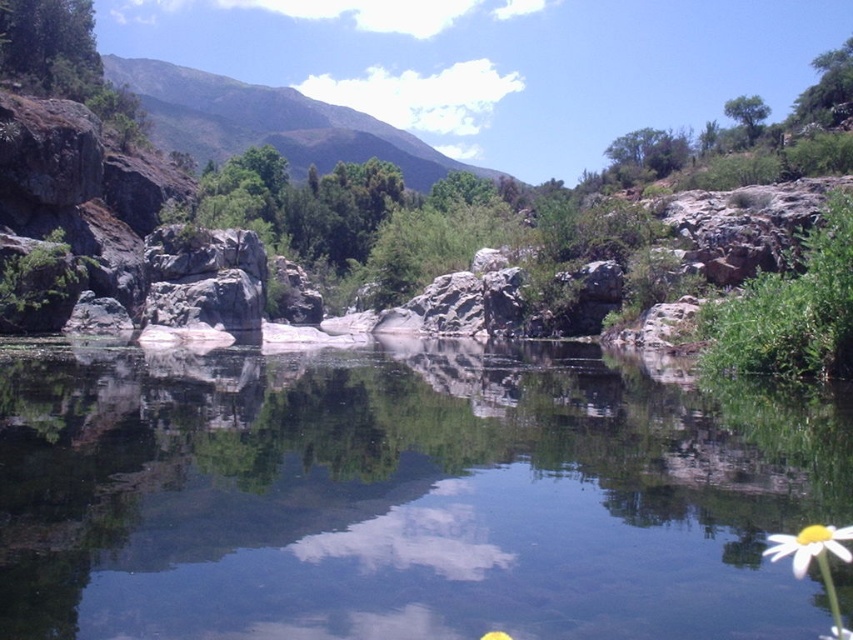
Is clear water at center taller than white matte flower at lower right?

No, clear water at center is not taller than white matte flower at lower right.

Is point (631, 589) in front of point (827, 540)?

That is False.

Find the location of `clear water at center`. clear water at center is located at coordinates (405, 497).

Can you confirm if clear water at center is smaller than green grassy mountain at upper center?

Yes, clear water at center is smaller than green grassy mountain at upper center.

Consider the image. Is clear water at center above green grassy mountain at upper center?

A: No.

Describe the element at coordinates (405, 497) in the screenshot. I see `clear water at center` at that location.

You are a GUI agent. You are given a task and a screenshot of the screen. Output one action in this format:
    pyautogui.click(x=<x>, y=<y>)
    Task: Click on the clear water at center
    This screenshot has width=853, height=640.
    Given the screenshot: What is the action you would take?
    pyautogui.click(x=405, y=497)

Can you confirm if clear water at center is positioned above gray rock at center?

No, clear water at center is not above gray rock at center.

Is clear water at center below gray rock at center?

Indeed, clear water at center is positioned under gray rock at center.

Is point (746, 512) less distant than point (183, 317)?

Yes, point (746, 512) is closer to viewer.

Identify the location of clear water at center. (405, 497).